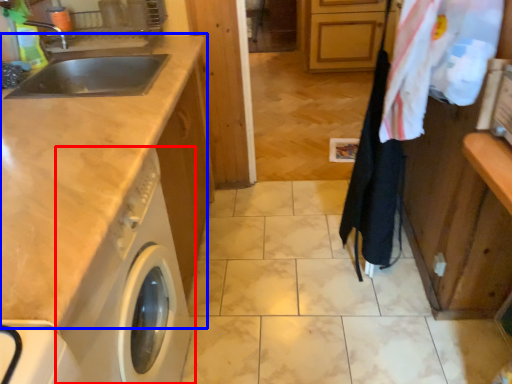
Question: Which object appears closest to the camera in this image, washing machine (highlighted by a red box) or countertop (highlighted by a blue box)?

Choices:
 (A) washing machine
 (B) countertop

Answer: (A)